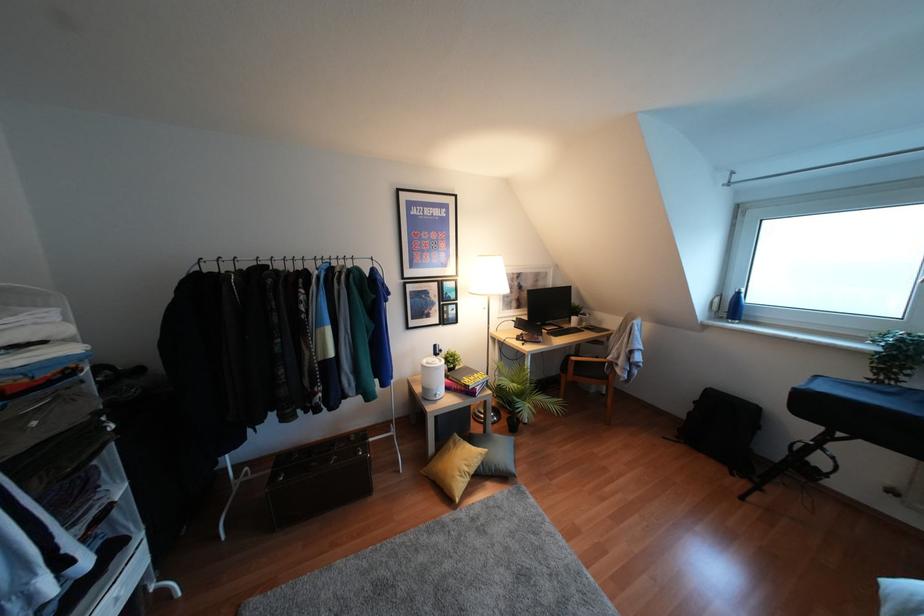
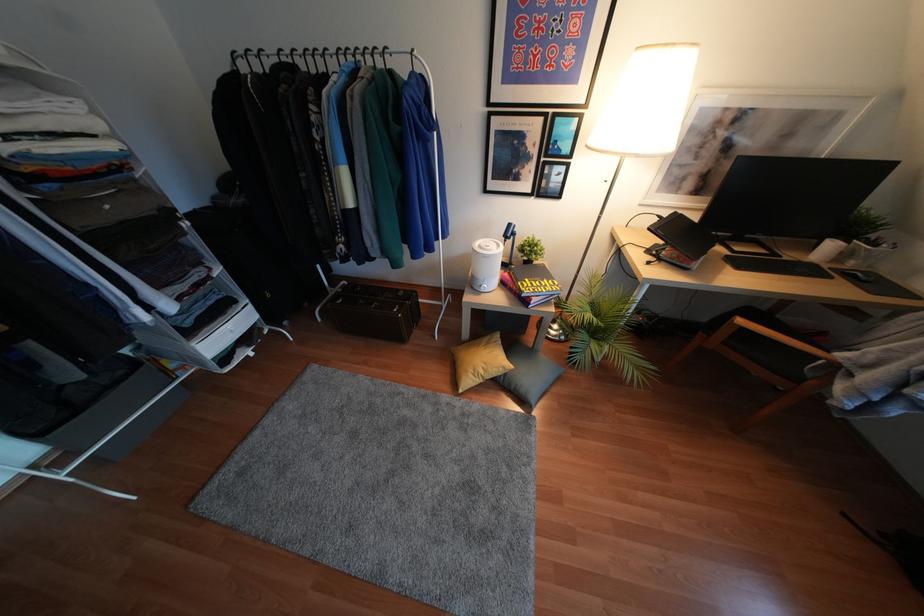
Find the pixel in the second image that matches point (436, 397) in the first image.

(481, 290)